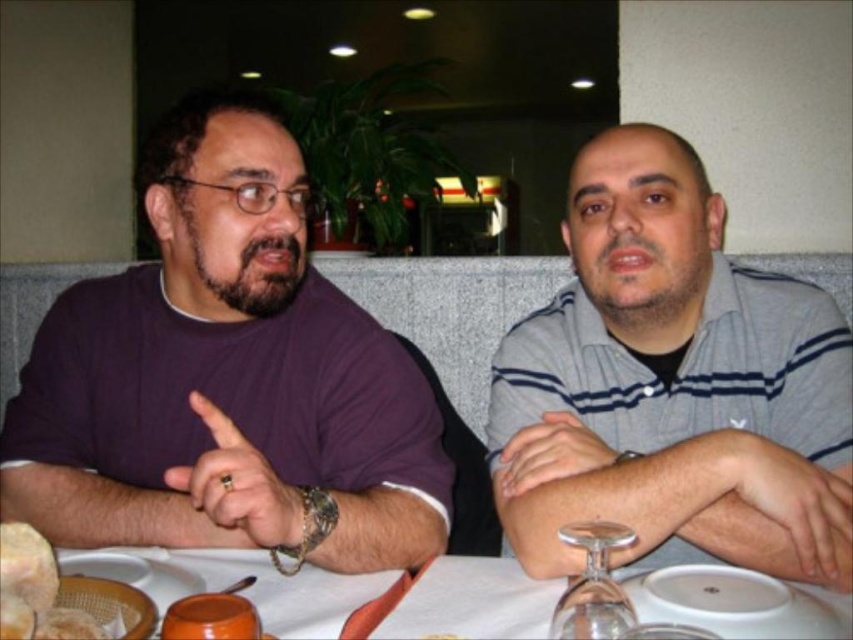
Can you confirm if purple matte shirt at left is thinner than transparent glass wine glass at lower center?

In fact, purple matte shirt at left might be wider than transparent glass wine glass at lower center.

Does purple matte shirt at left come behind transparent glass wine glass at lower center?

That is True.

Which is behind, point (338, 492) or point (610, 536)?

The point (338, 492) is behind.

This screenshot has height=640, width=853. What are the coordinates of `purple matte shirt at left` in the screenshot? It's located at (225, 378).

Is gray striped shirt at right positioned at the back of transparent glass wine glass at lower center?

Yes, it is.

Consider the image. Does gray striped shirt at right appear on the right side of transparent glass wine glass at lower center?

Yes, gray striped shirt at right is to the right of transparent glass wine glass at lower center.

Is point (706, 227) positioned in front of point (598, 595)?

No, (706, 227) is behind (598, 595).

Identify the location of gray striped shirt at right. The height and width of the screenshot is (640, 853). (672, 385).

Is gray striped shirt at right to the left of bread soft at lower left from the viewer's perspective?

Incorrect, gray striped shirt at right is not on the left side of bread soft at lower left.

Between gray striped shirt at right and bread soft at lower left, which one appears on the right side from the viewer's perspective?

Positioned to the right is gray striped shirt at right.

Locate an element on the screen. The image size is (853, 640). gray striped shirt at right is located at coordinates (672, 385).